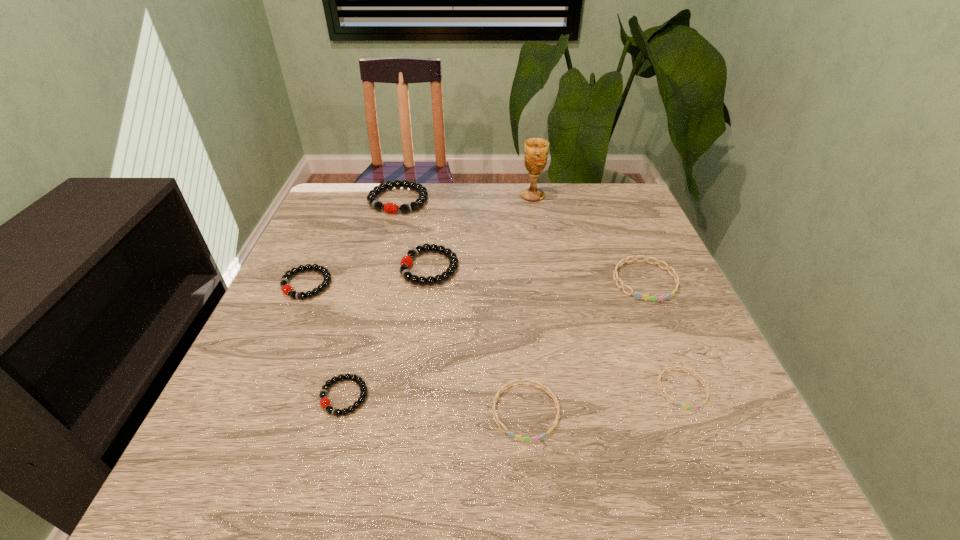
Find the location of a particular element. Image resolution: width=960 pixels, height=540 pixels. free space between the third bracelet from right to left and the second biggest black bracelet is located at coordinates (478, 340).

What are the coordinates of `free point between the leftmost black bracelet and the chalice` in the screenshot? It's located at (420, 240).

Find the location of a particular element. Image resolution: width=960 pixels, height=540 pixels. vacant point located between the leftmost bracelet and the second biggest black bracelet is located at coordinates (369, 276).

This screenshot has width=960, height=540. In order to click on vacant area between the chalice and the shortest bracelet in this screenshot , I will do `click(607, 292)`.

Locate an element on the screen. This screenshot has width=960, height=540. free space between the second biggest blue bracelet and the nearest black bracelet is located at coordinates (435, 404).

At what (x,y) coordinates should I click in order to perform the action: click on free space between the leftmost black bracelet and the smallest black bracelet. Please return your answer as a coordinate pair (x, y). The width and height of the screenshot is (960, 540). Looking at the image, I should click on (325, 341).

Where is `free area in between the leftmost bracelet and the tallest object`? This screenshot has width=960, height=540. free area in between the leftmost bracelet and the tallest object is located at coordinates (420, 240).

The width and height of the screenshot is (960, 540). Find the location of `vacant space that is in between the leftmost object and the farthest blue bracelet`. vacant space that is in between the leftmost object and the farthest blue bracelet is located at coordinates (476, 282).

I want to click on object that stands as the third closest to the smallest blue bracelet, so click(406, 262).

You are a GUI agent. You are given a task and a screenshot of the screen. Output one action in this format:
    pyautogui.click(x=<x>, y=<y>)
    Task: Click on the object identified as the fifth closest to the shortest bracelet
    The image size is (960, 540).
    Given the screenshot: What is the action you would take?
    pyautogui.click(x=536, y=150)